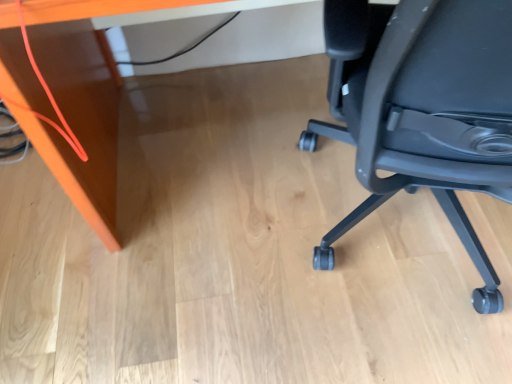
The width and height of the screenshot is (512, 384). I want to click on vacant space in matte orange desk at upper left (from a real-world perspective), so click(x=227, y=133).